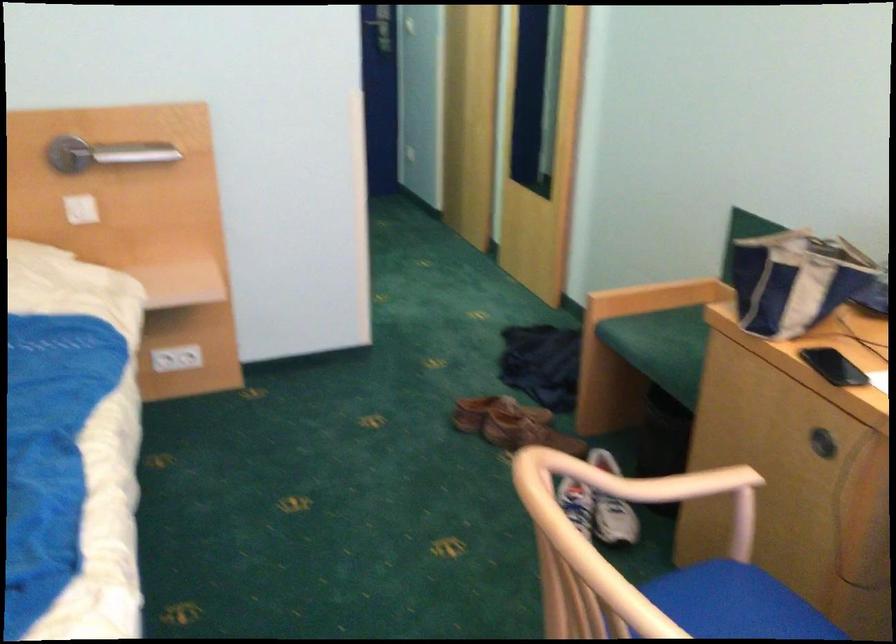
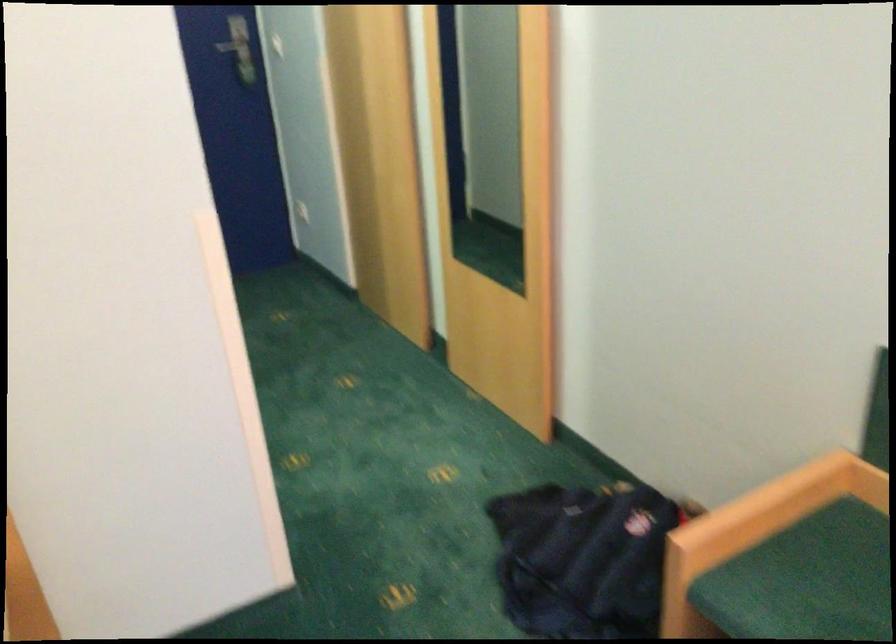
Find the pixel in the second image that matches (x=643, y=299) in the first image.

(756, 529)